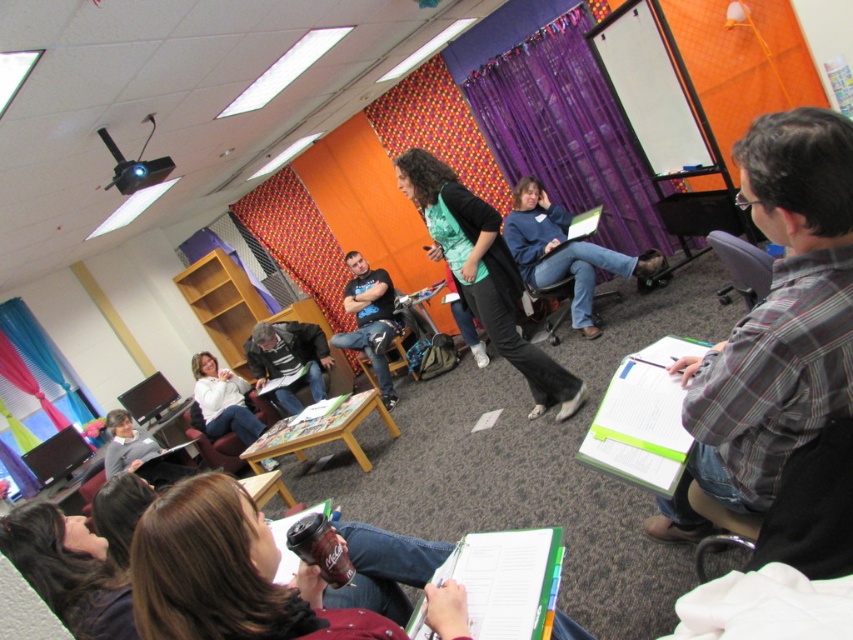
You are standing at the entrance of the classroom and want to approach the dark gray sweater at center and the brown leather chair at lower left. Which object will you reach first?

The dark gray sweater at center is closer to you, so you will reach it first before the brown leather chair at lower left.

You are standing at the center of the classroom and want to move towards the two points marked in the image. Which point, point 1 at coordinates point (x=286, y=340) or point 2 at coordinates point (x=200, y=435), is further away from you?

Point 1 at coordinates point (x=286, y=340) is further away from you because it is behind point 2 at coordinates point (x=200, y=435).

Based on the photo, you are a student who wants to sit down in the classroom. There is a teal fabric shirt at center and a metallic gray chair at lower right. Which object is wider?

The teal fabric shirt at center is wider than the metallic gray chair at lower right.